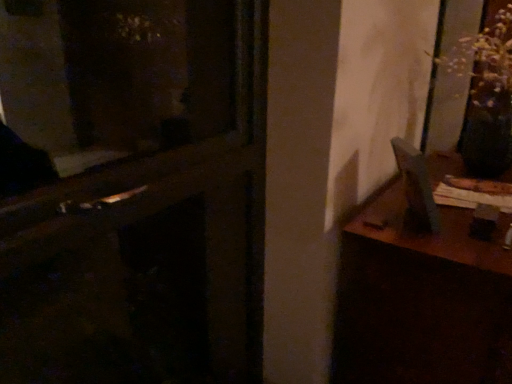
Measure the distance between point (x=374, y=214) and camera.

Point (x=374, y=214) and camera are 1.19 meters apart from each other.

Where is `wooden table at right`? This screenshot has width=512, height=384. wooden table at right is located at coordinates [x=430, y=233].

Describe the element at coordinates (430, 233) in the screenshot. I see `wooden table at right` at that location.

What do you see at coordinates (135, 192) in the screenshot?
I see `wooden door at center` at bounding box center [135, 192].

Locate an element on the screen. wooden door at center is located at coordinates (135, 192).

Where is `wooden table at right`? wooden table at right is located at coordinates (430, 233).

In the image, is wooden door at center on the left side or the right side of wooden table at right?

Clearly, wooden door at center is on the left of wooden table at right in the image.

Is wooden door at center positioned behind wooden table at right?

No, the depth of wooden door at center is less than that of wooden table at right.

Does point (240, 98) lie behind point (424, 251)?

Yes, it is.

From the image's perspective, between wooden door at center and wooden table at right, which one is located above?

wooden door at center is shown above in the image.

From a real-world perspective, which is physically above, wooden door at center or wooden table at right?

wooden door at center, from a real-world perspective.

Between wooden door at center and wooden table at right, which one has smaller width?

wooden door at center is thinner.

From the picture: From their relative heights in the image, would you say wooden door at center is taller or shorter than wooden table at right?

wooden door at center is taller than wooden table at right.

In the scene shown: Considering the relative sizes of wooden door at center and wooden table at right in the image provided, is wooden door at center smaller than wooden table at right?

Indeed, wooden door at center has a smaller size compared to wooden table at right.

Is wooden door at center inside the boundaries of wooden table at right, or outside?

wooden door at center is located beyond the bounds of wooden table at right.

In the scene shown: Are wooden door at center and wooden table at right located far from each other?

Yes, wooden door at center and wooden table at right are quite far apart.

Is wooden door at center looking in the opposite direction of wooden table at right?

No, wooden door at center is not facing the opposite direction of wooden table at right.

Can you tell me how much wooden door at center and wooden table at right differ in facing direction?

The angular difference between wooden door at center and wooden table at right is 0.918 degrees.

Where is `table that appears on the right of wooden door at center`? This screenshot has height=384, width=512. table that appears on the right of wooden door at center is located at coordinates (430, 233).

Between wooden table at right and wooden door at center, which one appears on the right side from the viewer's perspective?

Positioned to the right is wooden table at right.

Based on the photo, considering the positions of objects wooden table at right and wooden door at center in the image provided, who is in front, wooden table at right or wooden door at center?

wooden door at center is in front.

Which is in front, point (371, 225) or point (116, 46)?

The point (371, 225) is more forward.

From the image's perspective, is wooden table at right located beneath wooden door at center?

Yes, from the image's perspective, wooden table at right is beneath wooden door at center.

From a real-world perspective, who is located lower, wooden table at right or wooden door at center?

From a 3D spatial view, wooden table at right is below.

Between wooden table at right and wooden door at center, which one has smaller width?

With smaller width is wooden door at center.

From their relative heights in the image, would you say wooden table at right is taller or shorter than wooden door at center?

Considering their sizes, wooden table at right has less height than wooden door at center.

Based on the photo, which of these two, wooden table at right or wooden door at center, is bigger?

wooden table at right is bigger.

Would you say wooden table at right is inside or outside wooden door at center?

wooden table at right is not inside wooden door at center, it's outside.

Is wooden table at right far from wooden door at center?

Yes, wooden table at right and wooden door at center are quite far apart.

Is wooden table at right oriented towards wooden door at center?

No, wooden table at right is not facing towards wooden door at center.

At what (x,y) coordinates should I click in order to perform the action: click on table on the right of wooden door at center. Please return your answer as a coordinate pair (x, y). Looking at the image, I should click on (430, 233).

At what (x,y) coordinates should I click in order to perform the action: click on table behind the wooden door at center. Please return your answer as a coordinate pair (x, y). Image resolution: width=512 pixels, height=384 pixels. Looking at the image, I should click on (430, 233).

The image size is (512, 384). Identify the location of table that appears below the wooden door at center (from the image's perspective). (430, 233).